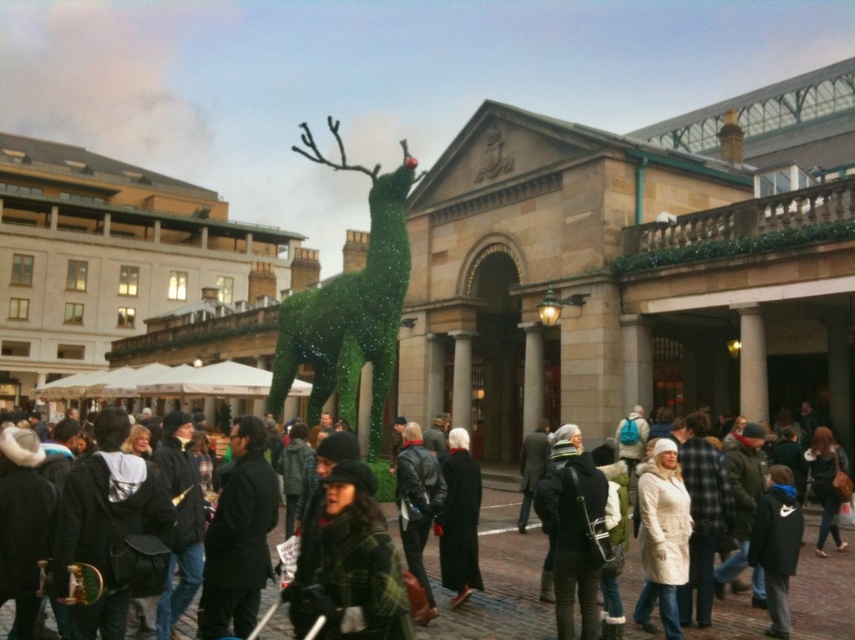
Question: Among these points, which one is farthest from the camera?

Choices:
 (A) (573, 598)
 (B) (416, 525)
 (C) (469, 593)

Answer: (B)

Question: Can you confirm if matte black coat at center is bigger than leather jacket at center?

Choices:
 (A) yes
 (B) no

Answer: (B)

Question: Does green glittering deer at center appear over green glittering coat at center?

Choices:
 (A) yes
 (B) no

Answer: (B)

Question: Which point is closer to the camera?

Choices:
 (A) (423, 497)
 (B) (375, 536)
 (C) (563, 604)
 (D) (534, 600)

Answer: (B)

Question: Which object is farther from the camera taking this photo?

Choices:
 (A) white matte coat at center
 (B) black matte coat at center
 (C) green glittering coat at center
 (D) green glittering deer at center

Answer: (A)

Question: Does green glittering deer at center appear on the left side of green glittering coat at center?

Choices:
 (A) no
 (B) yes

Answer: (A)